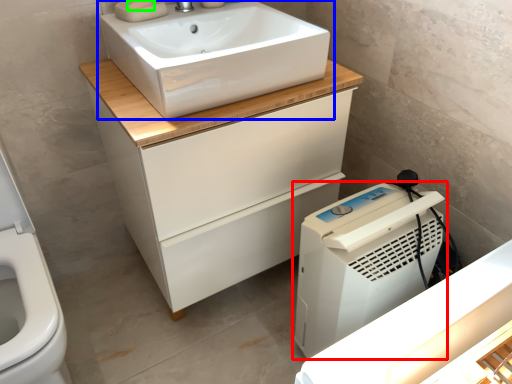
Question: Estimate the real-world distances between objects in this image. Which object is farther from home appliance (highlighted by a red box), sink (highlighted by a blue box) or soap (highlighted by a green box)?

Choices:
 (A) sink
 (B) soap

Answer: (B)